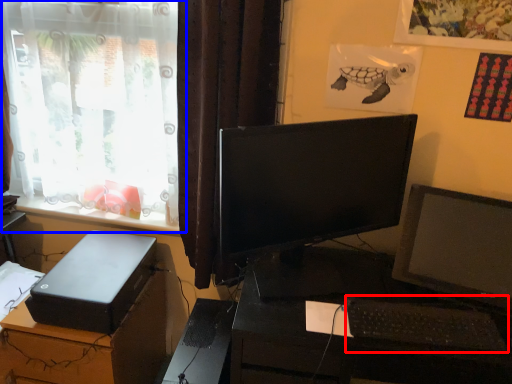
Question: Among these objects, which one is nearest to the camera, computer keyboard (highlighted by a red box) or window (highlighted by a blue box)?

Choices:
 (A) computer keyboard
 (B) window

Answer: (A)